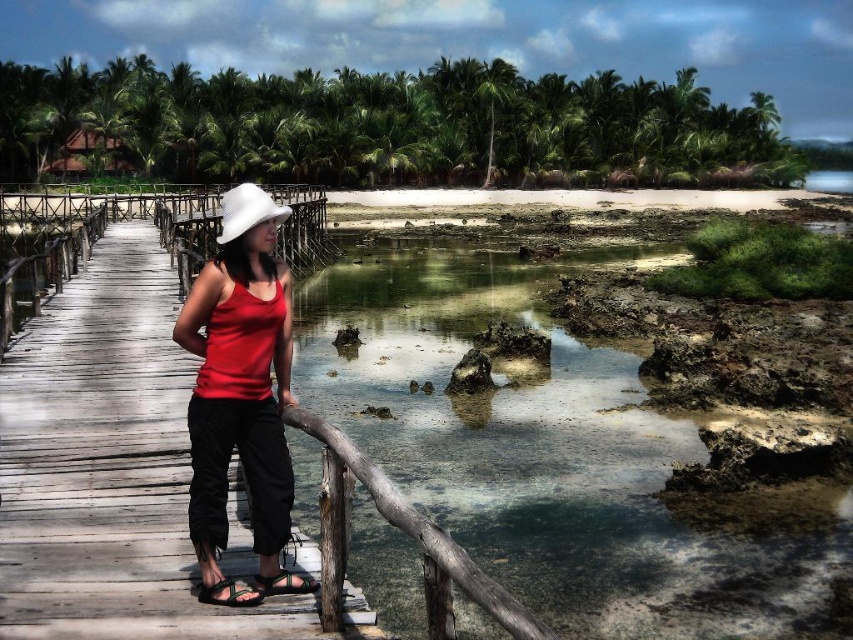
Who is taller, matte red tank top at center or black fabric sandal at lower center?

Standing taller between the two is matte red tank top at center.

Between point (265, 445) and point (245, 605), which one is positioned behind?

Positioned behind is point (265, 445).

You are a GUI agent. You are given a task and a screenshot of the screen. Output one action in this format:
    pyautogui.click(x=<x>, y=<y>)
    Task: Click on the matte red tank top at center
    The width and height of the screenshot is (853, 640).
    Given the screenshot: What is the action you would take?
    pyautogui.click(x=241, y=380)

Is matte red tank top at center taller than green fabric sandal at lower center?

Indeed, matte red tank top at center has a greater height compared to green fabric sandal at lower center.

Locate an element on the screen. This screenshot has height=640, width=853. matte red tank top at center is located at coordinates (241, 380).

Can you confirm if matte red tank top at center is positioned to the right of white felt hat at center?

Yes, matte red tank top at center is to the right of white felt hat at center.

In the scene shown: Which is more to the right, matte red tank top at center or white felt hat at center?

Positioned to the right is matte red tank top at center.

Identify the location of matte red tank top at center. (241, 380).

Locate an element on the screen. The height and width of the screenshot is (640, 853). matte red tank top at center is located at coordinates (241, 380).